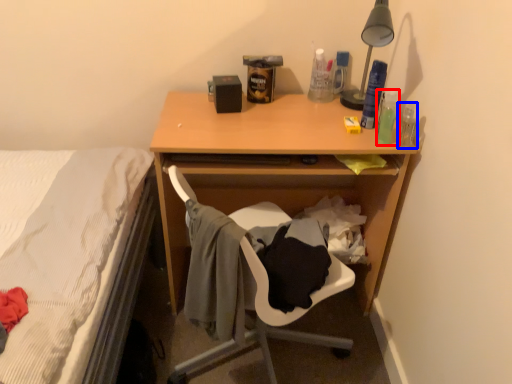
Question: Which point is closer to the camera, bottle (highlighted by a red box) or bottle (highlighted by a blue box)?

Choices:
 (A) bottle
 (B) bottle

Answer: (A)